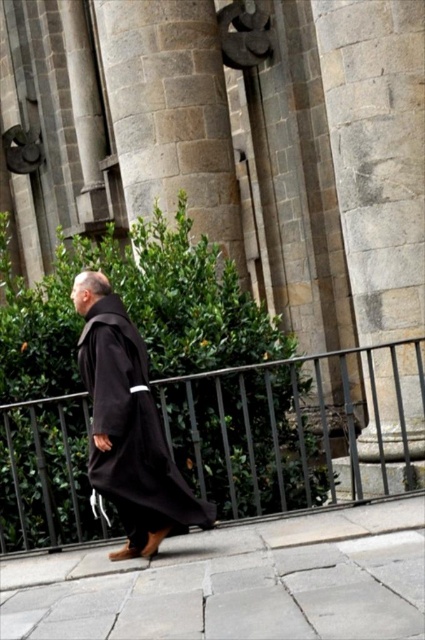
Question: Is the position of gray stone pavement at lower center more distant than that of matte black robe at center?

Choices:
 (A) yes
 (B) no

Answer: (B)

Question: Estimate the real-world distances between objects in this image. Which object is farther from the gray stone pavement at lower center?

Choices:
 (A) matte black robe at center
 (B) black metal fence at lower center

Answer: (B)

Question: Which of the following is the closest to the observer?

Choices:
 (A) gray stone pavement at lower center
 (B) matte black robe at center
 (C) black metal fence at lower center

Answer: (A)

Question: Does gray stone pavement at lower center have a smaller size compared to matte black robe at center?

Choices:
 (A) yes
 (B) no

Answer: (B)

Question: Considering the relative positions of black metal fence at lower center and gray stone pavement at lower center in the image provided, where is black metal fence at lower center located with respect to gray stone pavement at lower center?

Choices:
 (A) below
 (B) above

Answer: (B)

Question: Which point is farther from the camera taking this photo?

Choices:
 (A) (28, 560)
 (B) (155, 445)
 (C) (368, 376)

Answer: (C)